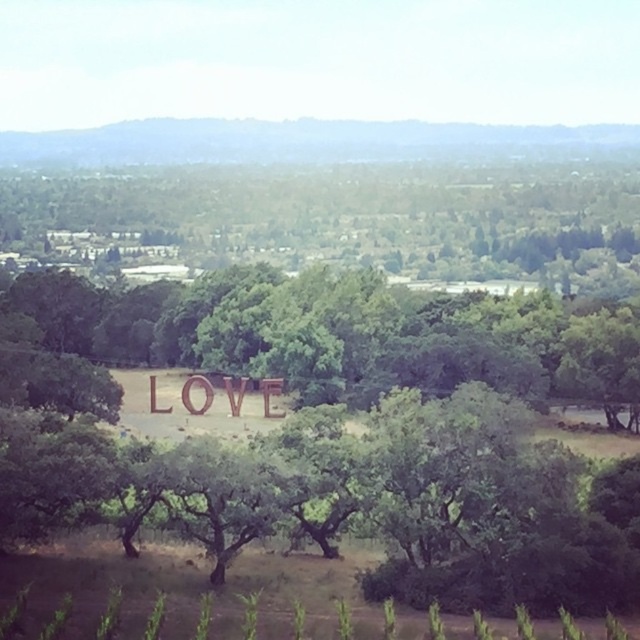
Question: Among these points, which one is nearest to the camera?

Choices:
 (A) (186, 408)
 (B) (225, 275)

Answer: (A)

Question: Is green leafy tree at center smaller than wooden sign at center?

Choices:
 (A) no
 (B) yes

Answer: (A)

Question: Does green leafy tree at center appear over wooden sign at center?

Choices:
 (A) yes
 (B) no

Answer: (A)

Question: Does green leafy tree at center have a lesser width compared to wooden sign at center?

Choices:
 (A) yes
 (B) no

Answer: (B)

Question: Which object is farther from the camera taking this photo?

Choices:
 (A) green leafy tree at center
 (B) wooden sign at center

Answer: (B)